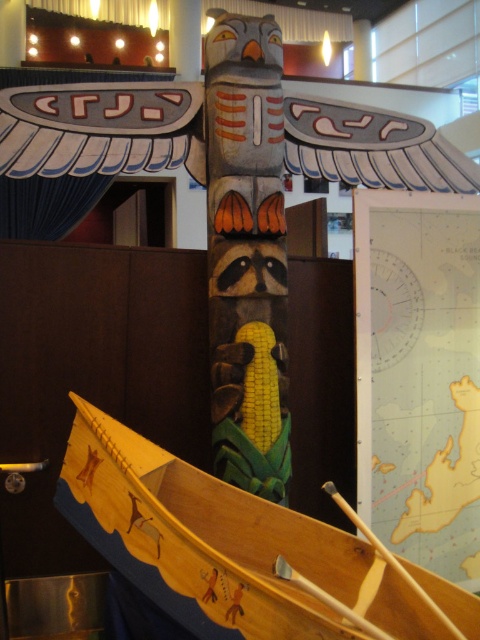
Question: Among these objects, which one is nearest to the camera?

Choices:
 (A) wooden at lower center
 (B) wooden canoe at center

Answer: (B)

Question: Can you confirm if wooden canoe at center is thinner than wooden at lower center?

Choices:
 (A) yes
 (B) no

Answer: (B)

Question: Is wooden canoe at center below wooden at lower center?

Choices:
 (A) no
 (B) yes

Answer: (A)

Question: Does wooden canoe at center appear over wooden at lower center?

Choices:
 (A) yes
 (B) no

Answer: (A)